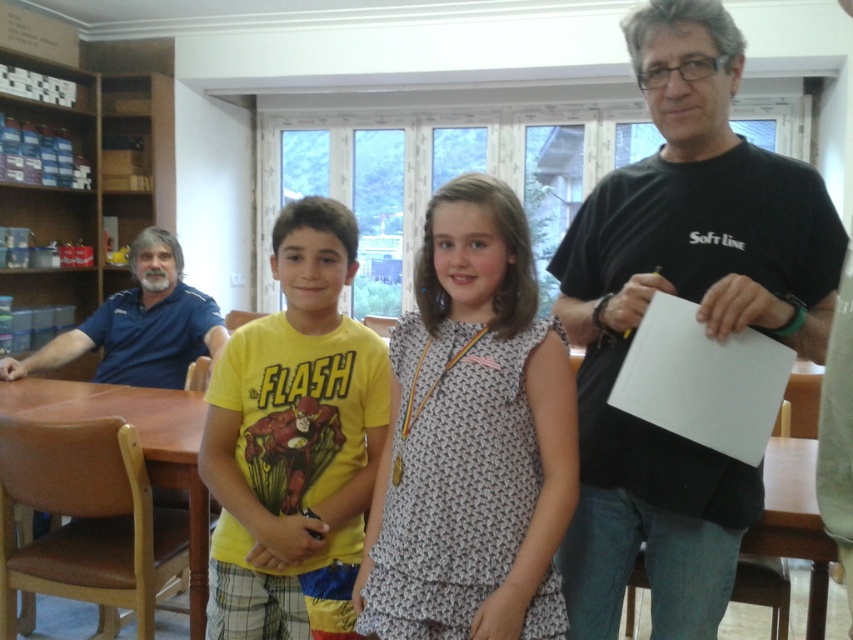
Question: Which object appears farthest from the camera in this image?

Choices:
 (A) black matte t-shirt at center
 (B) yellow cotton t-shirt at center

Answer: (B)

Question: Which point appears closest to the camera in this image?

Choices:
 (A) (521, 531)
 (B) (254, 356)
 (C) (606, 429)
 (D) (109, 368)

Answer: (A)

Question: Is blue cotton shirt at left smaller than brown wooden table at center?

Choices:
 (A) no
 (B) yes

Answer: (B)

Question: Among these objects, which one is farthest from the camera?

Choices:
 (A) yellow cotton t-shirt at center
 (B) blue cotton shirt at left

Answer: (B)

Question: Is the position of printed cotton dress at center more distant than that of brown wooden table at center?

Choices:
 (A) yes
 (B) no

Answer: (B)

Question: Is printed cotton dress at center thinner than blue cotton shirt at left?

Choices:
 (A) yes
 (B) no

Answer: (A)